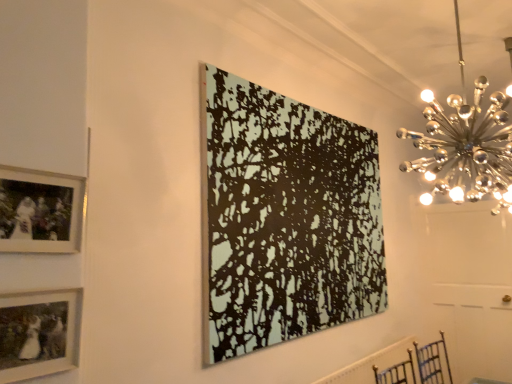
Question: From their relative heights in the image, would you say white textured radiator at lower right is taller or shorter than matte silver picture frame at upper left, which is counted as the first picture frame, starting from the left?

Choices:
 (A) tall
 (B) short

Answer: (B)

Question: Based on their sizes in the image, would you say white textured radiator at lower right is bigger or smaller than matte silver picture frame at upper left, the 3th picture frame viewed from the right?

Choices:
 (A) small
 (B) big

Answer: (B)

Question: Which object is the closest to the white textured radiator at lower right?

Choices:
 (A) polished chrome chandelier at upper right
 (B) black textured canvas at center, which appears as the 1th picture frame when viewed from the right
 (C) matte black picture frame at lower left, arranged as the second picture frame when viewed from the right
 (D) matte silver picture frame at upper left, the second picture frame viewed from the front

Answer: (B)

Question: Which object is the farthest from the white textured radiator at lower right?

Choices:
 (A) matte black picture frame at lower left, positioned as the 2th picture frame in left-to-right order
 (B) black textured canvas at center, which appears as the 1th picture frame when viewed from the right
 (C) polished chrome chandelier at upper right
 (D) matte silver picture frame at upper left, which is counted as the first picture frame, starting from the left

Answer: (D)